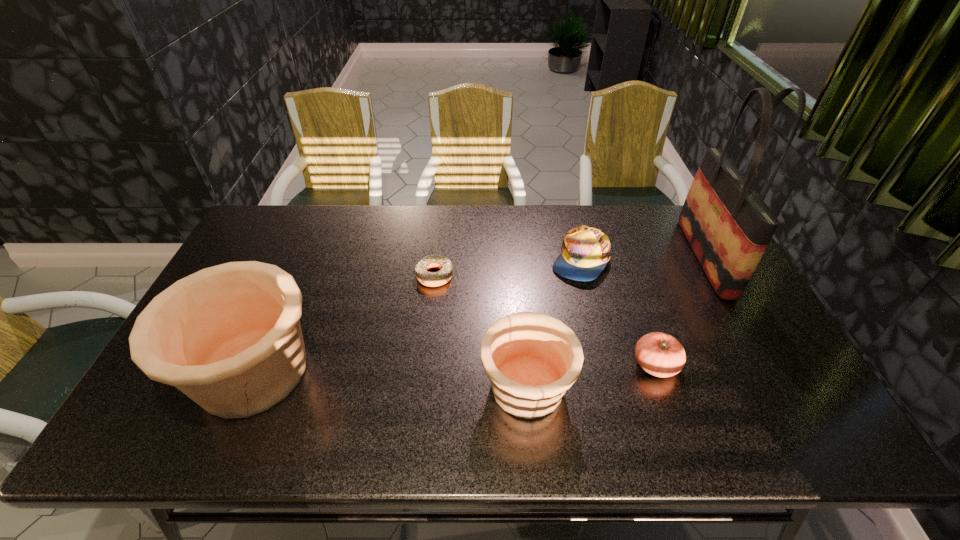
Locate an element on the screen. The image size is (960, 540). tomato at the near edge is located at coordinates (659, 354).

Locate an element on the screen. The height and width of the screenshot is (540, 960). object present at the left edge is located at coordinates (229, 337).

Find the location of `object that is at the right edge`. object that is at the right edge is located at coordinates (728, 225).

Where is `object located at the near left corner`? Image resolution: width=960 pixels, height=540 pixels. object located at the near left corner is located at coordinates (229, 337).

Find the location of a particular element. The height and width of the screenshot is (540, 960). object at the far right corner is located at coordinates (728, 225).

In the image, there is a desktop. Identify the location of vacant space at the far edge. (304, 217).

Identify the location of free space at the near edge of the desktop. Image resolution: width=960 pixels, height=540 pixels. (713, 381).

Where is `free location at the left edge`? This screenshot has width=960, height=540. free location at the left edge is located at coordinates (263, 258).

Identify the location of free space at the right edge. The image size is (960, 540). (745, 338).

The image size is (960, 540). What are the coordinates of `vacant position at the far left corner of the desktop` in the screenshot? It's located at (251, 233).